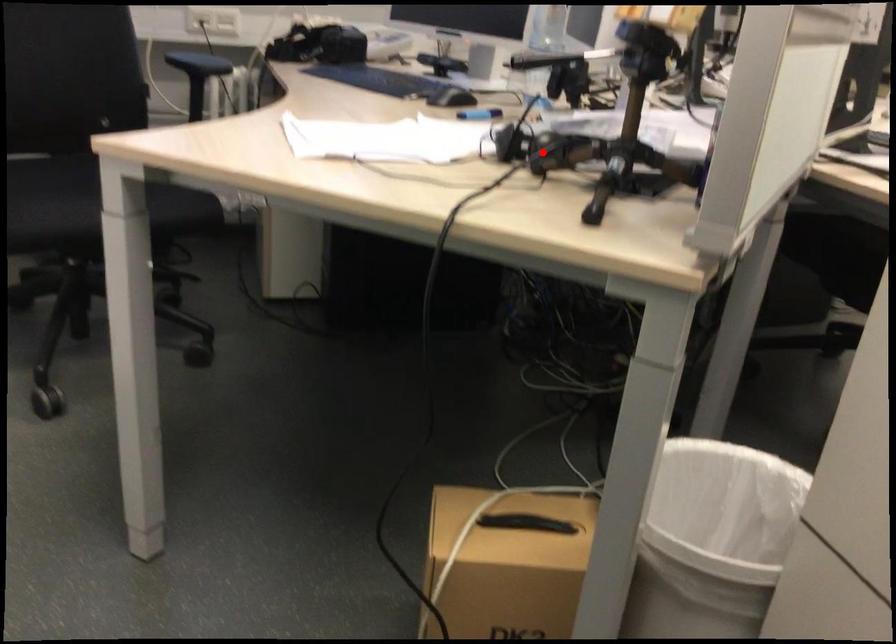
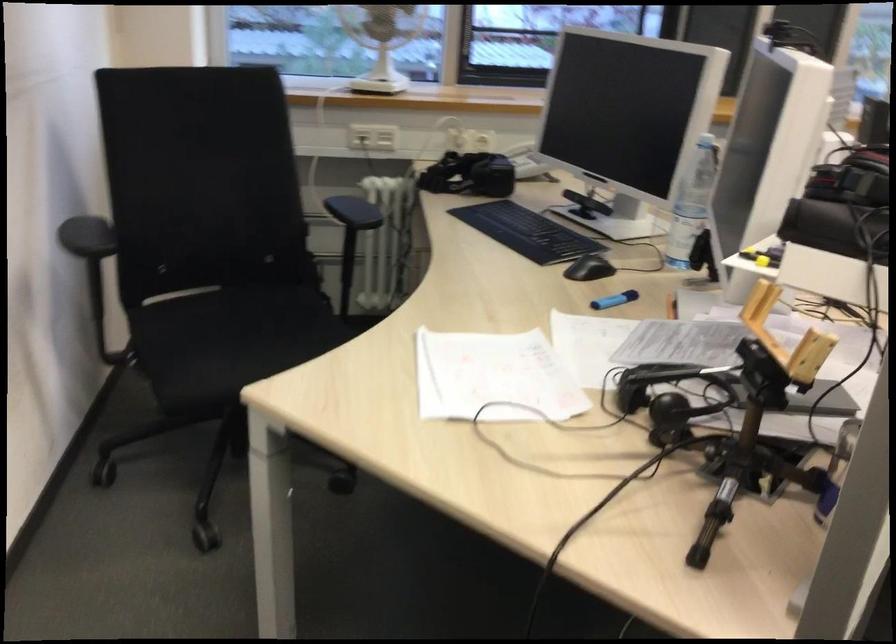
Find the pixel in the second image that matches the highlighted location in the first image.

(672, 389)